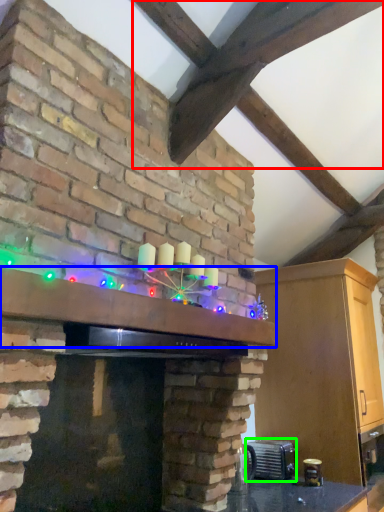
Question: Which object is the closest to the exhaust hood (highlighted by a red box)? Choose among these: mantle (highlighted by a blue box) or appliance (highlighted by a green box).

Choices:
 (A) mantle
 (B) appliance

Answer: (A)